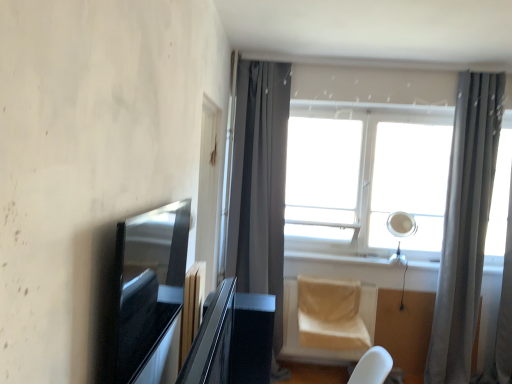
Question: Is white glass window at center next to white plastic window sill at center?

Choices:
 (A) yes
 (B) no

Answer: (B)

Question: Is white glass window at center behind white plastic window sill at center?

Choices:
 (A) no
 (B) yes

Answer: (A)

Question: From the image's perspective, is white glass window at center on white plastic window sill at center?

Choices:
 (A) yes
 (B) no

Answer: (A)

Question: Is white glass window at center smaller than white plastic window sill at center?

Choices:
 (A) no
 (B) yes

Answer: (A)

Question: Could you tell me if white glass window at center is turned towards white plastic window sill at center?

Choices:
 (A) no
 (B) yes

Answer: (A)

Question: From their relative heights in the image, would you say gray sheer curtain at right, which is counted as the 2th curtain, starting from the left, is taller or shorter than white plastic window sill at center?

Choices:
 (A) short
 (B) tall

Answer: (B)

Question: From the image's perspective, is gray sheer curtain at right, which is counted as the 2th curtain, starting from the left, located above or below white plastic window sill at center?

Choices:
 (A) below
 (B) above

Answer: (B)

Question: From a real-world perspective, is gray sheer curtain at right, the 1th curtain viewed from the right, above or below white plastic window sill at center?

Choices:
 (A) above
 (B) below

Answer: (A)

Question: Based on their positions, is gray sheer curtain at right, which is counted as the 2th curtain, starting from the left, located to the left or right of white plastic window sill at center?

Choices:
 (A) right
 (B) left

Answer: (A)

Question: Is point (488, 115) positioned closer to the camera than point (237, 200)?

Choices:
 (A) farther
 (B) closer

Answer: (B)

Question: Considering the positions of gray sheer curtain at right, which is counted as the 2th curtain, starting from the left, and dark gray fabric curtain at center, the 1th curtain viewed from the left, in the image, is gray sheer curtain at right, which is counted as the 2th curtain, starting from the left, taller or shorter than dark gray fabric curtain at center, the 1th curtain viewed from the left,?

Choices:
 (A) tall
 (B) short

Answer: (A)

Question: Based on their positions, is gray sheer curtain at right, the 1th curtain viewed from the right, located to the left or right of dark gray fabric curtain at center, the second curtain when ordered from right to left?

Choices:
 (A) right
 (B) left

Answer: (A)

Question: From the image's perspective, relative to dark gray fabric curtain at center, the 1th curtain viewed from the left, is gray sheer curtain at right, the 1th curtain viewed from the right, above or below?

Choices:
 (A) above
 (B) below

Answer: (B)

Question: Is white plastic window sill at center bigger or smaller than gray sheer curtain at right, the 1th curtain viewed from the right?

Choices:
 (A) small
 (B) big

Answer: (A)

Question: Is white plastic window sill at center to the left or to the right of gray sheer curtain at right, the 1th curtain viewed from the right, in the image?

Choices:
 (A) right
 (B) left

Answer: (B)